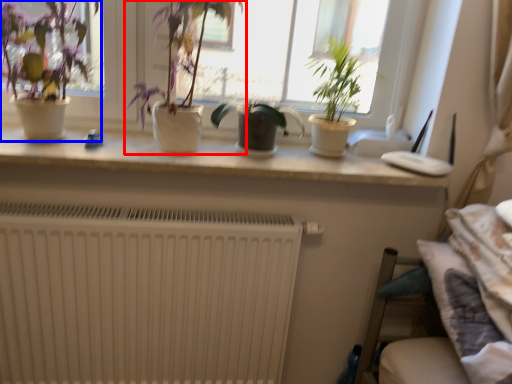
Question: Which of the following is the farthest to the observer, houseplant (highlighted by a red box) or houseplant (highlighted by a blue box)?

Choices:
 (A) houseplant
 (B) houseplant

Answer: (B)